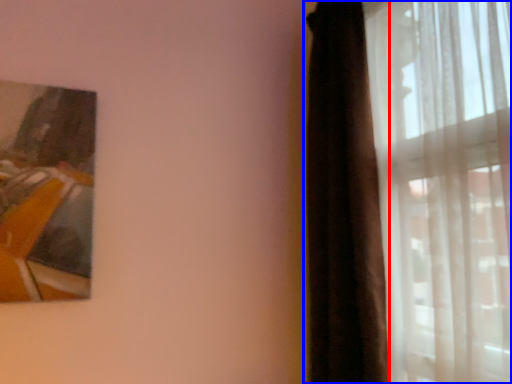
Question: Which object is further to the camera taking this photo, curtain (highlighted by a red box) or curtain (highlighted by a blue box)?

Choices:
 (A) curtain
 (B) curtain

Answer: (A)